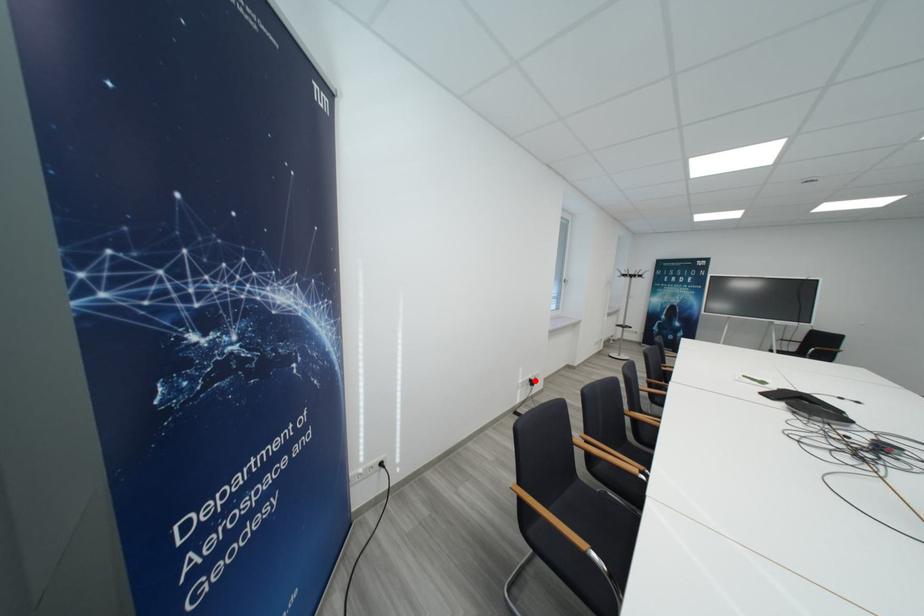
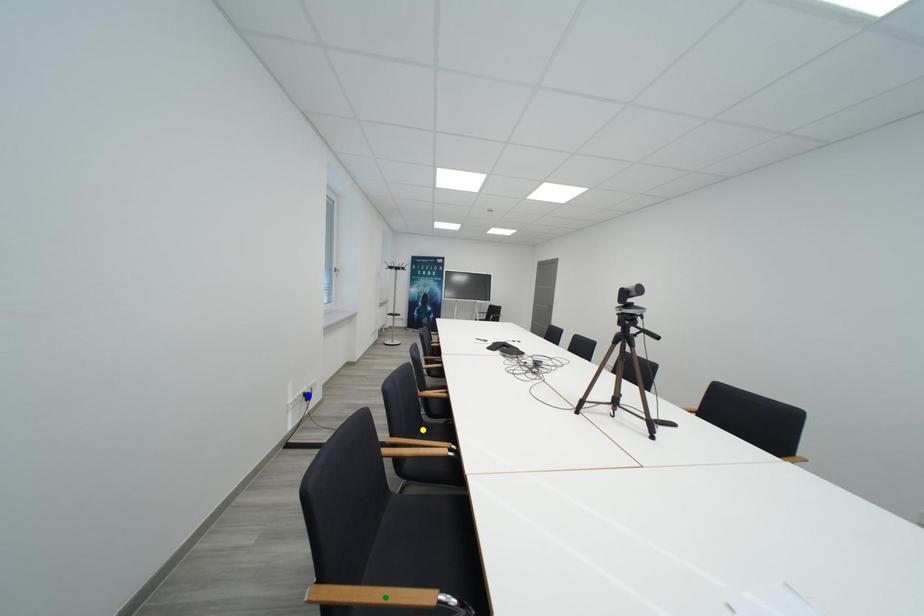
Question: I am providing you with two images of the same scene from different viewpoints. A red point is marked on the first image. You are given multiple points on the second image. Which mark in image 2 goes with the point in image 1?

Choices:
 (A) green point
 (B) blue point
 (C) yellow point

Answer: (B)